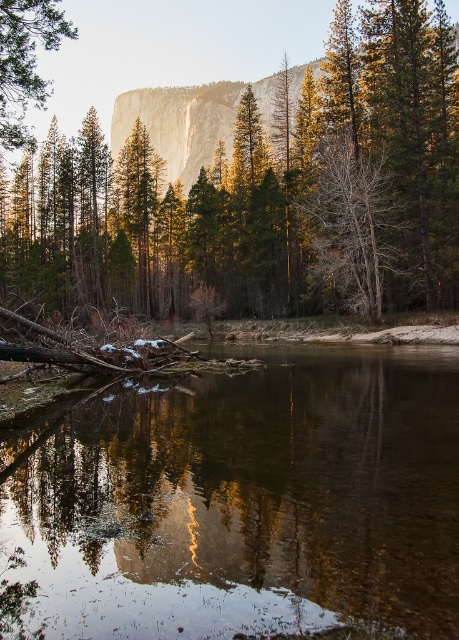
Can you confirm if clear water at center is positioned above bare wood tree at center?

No, clear water at center is not above bare wood tree at center.

Based on the photo, who is taller, clear water at center or bare wood tree at center?

With more height is bare wood tree at center.

The width and height of the screenshot is (459, 640). What do you see at coordinates (244, 502) in the screenshot? I see `clear water at center` at bounding box center [244, 502].

Image resolution: width=459 pixels, height=640 pixels. What are the coordinates of `clear water at center` in the screenshot? It's located at (244, 502).

Is green matte trees at center thinner than bare wood tree at center?

Incorrect, green matte trees at center's width is not less than bare wood tree at center's.

The width and height of the screenshot is (459, 640). Describe the element at coordinates (257, 186) in the screenshot. I see `green matte trees at center` at that location.

The image size is (459, 640). I want to click on green matte trees at center, so pos(257,186).

Can you confirm if clear water at center is smaller than green matte tree at upper left?

Yes.

This screenshot has height=640, width=459. I want to click on clear water at center, so click(244, 502).

At what (x,y) coordinates should I click in order to perform the action: click on clear water at center. Please return your answer as a coordinate pair (x, y). The height and width of the screenshot is (640, 459). Looking at the image, I should click on (244, 502).